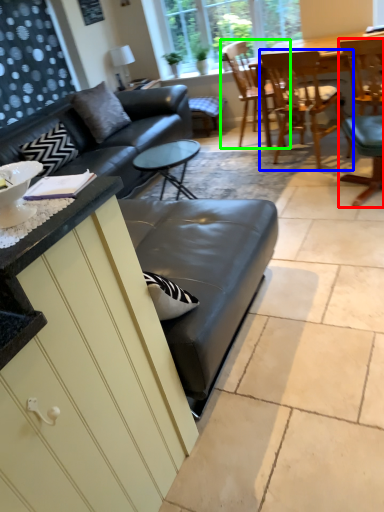
Question: Which object is positioned closest to chair (highlighted by a red box)? Select from chair (highlighted by a blue box) and chair (highlighted by a green box).

Choices:
 (A) chair
 (B) chair

Answer: (A)